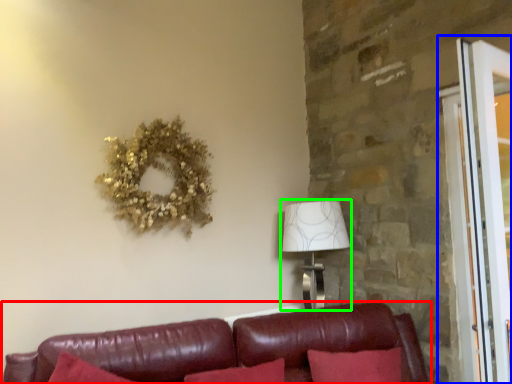
Question: Which object is positioned closest to studio couch (highlighted by a red box)? Select from screen door (highlighted by a blue box) and table lamp (highlighted by a green box).

Choices:
 (A) screen door
 (B) table lamp

Answer: (B)